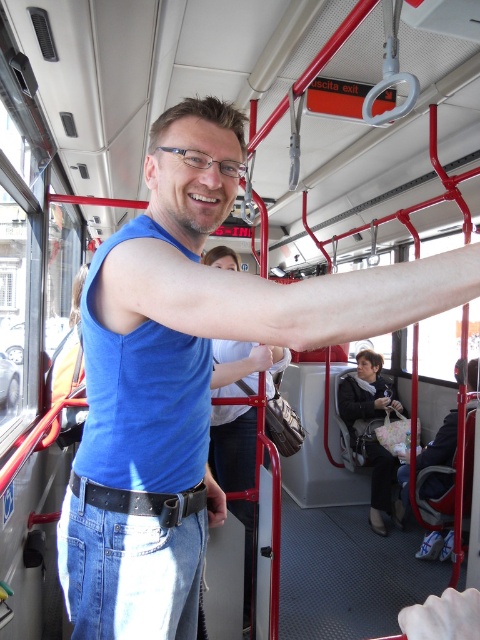
Is matte blue shirt at center thinner than matte black handbag at lower center?

Yes, matte blue shirt at center is thinner than matte black handbag at lower center.

Who is more forward, (269,356) or (379,403)?

Positioned in front is point (269,356).

Identify the location of matte blue shirt at center. This screenshot has height=640, width=480. (260, 358).

Can you confirm if matte black handbag at lower center is smaller than matte black hand at upper center?

Yes, matte black handbag at lower center is smaller than matte black hand at upper center.

The height and width of the screenshot is (640, 480). What do you see at coordinates (382, 403) in the screenshot?
I see `matte black handbag at lower center` at bounding box center [382, 403].

The image size is (480, 640). Identify the location of matte black handbag at lower center. (382, 403).

Does matte black belt at lower center appear over matte black handbag at lower center?

Yes, matte black belt at lower center is above matte black handbag at lower center.

Is matte black belt at lower center positioned in front of matte black handbag at lower center?

Yes, it is.

What are the coordinates of `matte black belt at lower center` in the screenshot? It's located at (215, 500).

What are the coordinates of `matte black belt at lower center` in the screenshot? It's located at (215, 500).